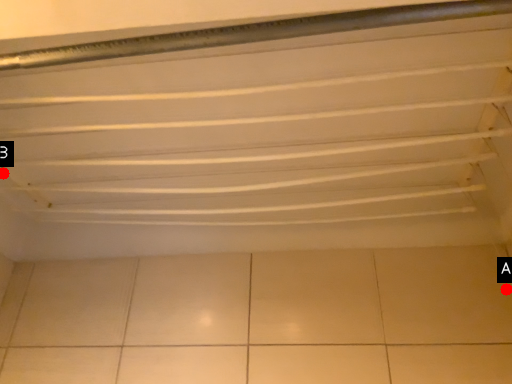
Question: Two points are circled on the image, labeled by A and B beside each circle. Which of the following is the farthest from the observer?

Choices:
 (A) A is further
 (B) B is further

Answer: (B)